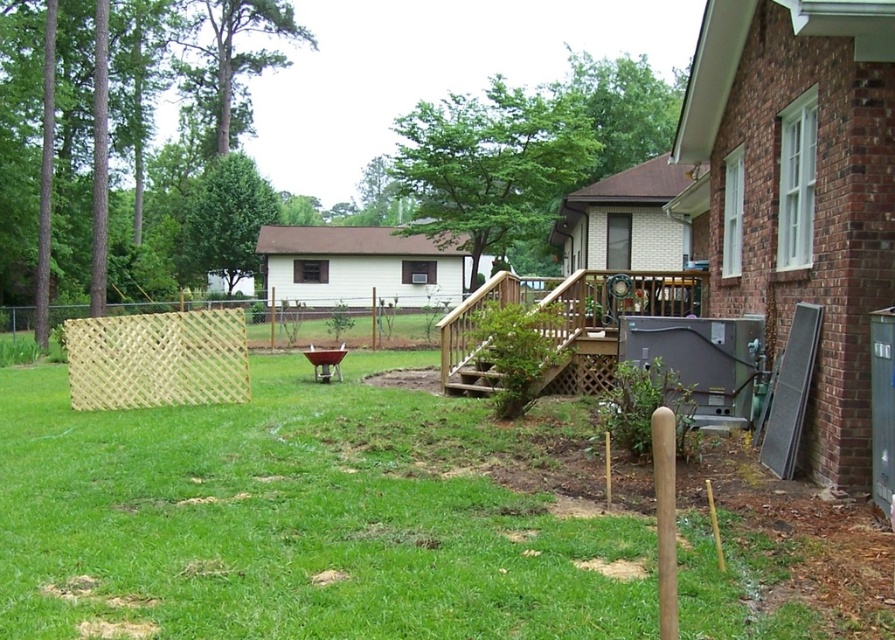
Question: Estimate the real-world distances between objects in this image. Which object is farther from the brown wooden porch at center?

Choices:
 (A) brown wooden stairs at center
 (B) light brown lattice fence at lower left

Answer: (B)

Question: Can you confirm if light brown lattice fence at lower left is bigger than brown wooden porch at center?

Choices:
 (A) yes
 (B) no

Answer: (B)

Question: Which point is farther from the camera taking this photo?

Choices:
 (A) (229, 388)
 (B) (550, 321)

Answer: (A)

Question: Among these objects, which one is nearest to the camera?

Choices:
 (A) brown wooden stairs at center
 (B) brown wooden porch at center
 (C) light brown lattice fence at lower left

Answer: (A)

Question: Does light brown lattice fence at lower left appear over brown wooden porch at center?

Choices:
 (A) yes
 (B) no

Answer: (B)

Question: Is light brown lattice fence at lower left below brown wooden porch at center?

Choices:
 (A) no
 (B) yes

Answer: (B)